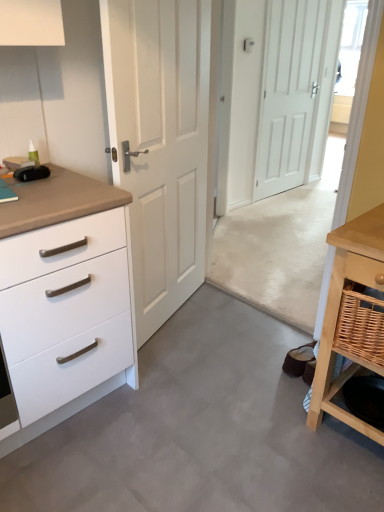
Describe the element at coordinates (200, 431) in the screenshot. The height and width of the screenshot is (512, 384). I see `gray laminate floor at center` at that location.

What is the approximate width of white matte chest of drawers at left?

The width of white matte chest of drawers at left is 25.38 inches.

The image size is (384, 512). Find the location of `transparent glass door at upper right`. transparent glass door at upper right is located at coordinates (348, 63).

What is the approximate width of transparent glass door at upper right?

9.49 centimeters.

What do you see at coordinates (160, 143) in the screenshot? The height and width of the screenshot is (512, 384). I see `white matte door at center, the 2th door when ordered from back to front` at bounding box center [160, 143].

Measure the distance between white matte door at center, arranged as the first door when viewed from the left, and camera.

white matte door at center, arranged as the first door when viewed from the left, and camera are 1.53 meters apart.

Measure the distance between point (363, 297) and camera.

Point (363, 297) is 4.42 feet from camera.

Where is `light wood table at lower right`? light wood table at lower right is located at coordinates (351, 317).

Which of these two, light wood table at lower right or gray laminate floor at center, is thinner?

light wood table at lower right is thinner.

How many degrees apart are the facing directions of light wood table at lower right and gray laminate floor at center?

light wood table at lower right and gray laminate floor at center are facing 180 degrees away from each other.

From a real-world perspective, is light wood table at lower right positioned over gray laminate floor at center based on gravity?

Indeed, from a real-world perspective, light wood table at lower right stands above gray laminate floor at center.

Relative to gray laminate floor at center, is light wood table at lower right in front or behind?

light wood table at lower right is behind gray laminate floor at center.

Where is `basket lying above the gray laminate floor at center (from the image's perspective)`? basket lying above the gray laminate floor at center (from the image's perspective) is located at coordinates (360, 328).

From a real-world perspective, which is physically above, gray laminate floor at center or woven brown basket at lower right?

woven brown basket at lower right is physically above.

Could you tell me if gray laminate floor at center is turned towards woven brown basket at lower right?

No, gray laminate floor at center is not turned towards woven brown basket at lower right.

Does point (245, 377) lie in front of point (372, 315)?

No, it is not.

From a real-world perspective, which door is the 1st one above the white matte chest of drawers at left? Please provide its 2D coordinates.

[(160, 143)]

Is point (102, 295) behind point (189, 62)?

That is False.

Is white matte chest of drawers at left directly adjacent to white matte door at center, placed as the 2th door when sorted from right to left?

No, white matte chest of drawers at left is not making contact with white matte door at center, placed as the 2th door when sorted from right to left.

From a real-world perspective, is white matte chest of drawers at left below white matte door at center, arranged as the first door when viewed from the left?

Correct, in the physical world, white matte chest of drawers at left is lower than white matte door at center, arranged as the first door when viewed from the left.

Is light wood table at lower right positioned with its back to white matte door at center, the 2th door when ordered from back to front?

light wood table at lower right is not turned away from white matte door at center, the 2th door when ordered from back to front.

Can you tell me how much light wood table at lower right and white matte door at center, which is counted as the first door, starting from the front, differ in facing direction?

109 degrees.

Which object is wider, light wood table at lower right or white matte door at center, placed as the 2th door when sorted from right to left?

With larger width is light wood table at lower right.

From the image's perspective, starting from the light wood table at lower right, which door is the 1st one above? Please provide its 2D coordinates.

[(160, 143)]

Which object is further away from the camera taking this photo, white matte chest of drawers at left or light wood table at lower right?

light wood table at lower right.

Measure the distance between white matte chest of drawers at left and light wood table at lower right.

white matte chest of drawers at left is 88.57 centimeters away from light wood table at lower right.

Is white matte chest of drawers at left bigger or smaller than light wood table at lower right?

Considering their sizes, white matte chest of drawers at left takes up more space than light wood table at lower right.

Considering the positions of objects white matte chest of drawers at left and light wood table at lower right in the image provided, who is more to the left, white matte chest of drawers at left or light wood table at lower right?

From the viewer's perspective, white matte chest of drawers at left appears more on the left side.

Who is shorter, white matte door at center, the first door in the back-to-front sequence, or gray laminate floor at center?

gray laminate floor at center is shorter.

Between white matte door at center, the first door in the back-to-front sequence, and gray laminate floor at center, which one has smaller width?

white matte door at center, the first door in the back-to-front sequence, is thinner.

At what (x,y) coordinates should I click in order to perform the action: click on concrete on the left of white matte door at center, the first door viewed from the right. Please return your answer as a coordinate pair (x, y). Looking at the image, I should click on point(200,431).

Is white matte door at center, positioned as the second door in front-to-back order, positioned with its back to gray laminate floor at center?

No, gray laminate floor at center is not at the back of white matte door at center, positioned as the second door in front-to-back order.

In the scene shown: Does white matte door at center, which is counted as the first door, starting from the front, have a larger size compared to light wood table at lower right?

Yes.

Is white matte door at center, the 2th door when ordered from back to front, not close to light wood table at lower right?

Yes, white matte door at center, the 2th door when ordered from back to front, and light wood table at lower right are quite far apart.

Is point (132, 186) positioned after point (346, 231)?

Yes, point (132, 186) is behind point (346, 231).

Would you say white matte door at center, which is counted as the first door, starting from the front, is outside light wood table at lower right?

white matte door at center, which is counted as the first door, starting from the front, lies outside light wood table at lower right's area.

Locate an element on the screen. The width and height of the screenshot is (384, 512). concrete that appears below the light wood table at lower right (from a real-world perspective) is located at coordinates (200, 431).

Locate an element on the screen. The image size is (384, 512). basket above the gray laminate floor at center (from the image's perspective) is located at coordinates (360, 328).

Estimate the real-world distances between objects in this image. Which object is closer to transparent glass door at upper right, woven brown basket at lower right or white matte door at center, the first door in the back-to-front sequence?

Based on the image, white matte door at center, the first door in the back-to-front sequence, appears to be nearer to transparent glass door at upper right.

When comparing their distances from white matte door at center, arranged as the first door when viewed from the left, does gray laminate floor at center or light wood table at lower right seem closer?

Based on the image, gray laminate floor at center appears to be nearer to white matte door at center, arranged as the first door when viewed from the left.

Which object lies further to the anchor point light wood table at lower right, white matte door at center, the 2th door when ordered from back to front, or woven brown basket at lower right?

The object further to light wood table at lower right is white matte door at center, the 2th door when ordered from back to front.

In the scene shown: Considering their positions, is light wood table at lower right positioned further to gray laminate floor at center than woven brown basket at lower right?

woven brown basket at lower right lies further to gray laminate floor at center than the other object.

Based on their spatial positions, is woven brown basket at lower right or gray laminate floor at center closer to transparent glass door at upper right?

gray laminate floor at center lies closer to transparent glass door at upper right than the other object.

In the scene shown: When comparing their distances from white matte door at center, placed as the 2th door when sorted from right to left, does woven brown basket at lower right or white matte door at center, positioned as the second door in front-to-back order, seem further?

Among the two, white matte door at center, positioned as the second door in front-to-back order, is located further to white matte door at center, placed as the 2th door when sorted from right to left.

From the image, which object appears to be nearer to white matte chest of drawers at left, transparent glass door at upper right or gray laminate floor at center?

Based on the image, gray laminate floor at center appears to be nearer to white matte chest of drawers at left.

Considering their positions, is white matte door at center, the first door in the back-to-front sequence, positioned closer to white matte door at center, arranged as the first door when viewed from the left, than light wood table at lower right?

The object closer to white matte door at center, arranged as the first door when viewed from the left, is light wood table at lower right.

You are a GUI agent. You are given a task and a screenshot of the screen. Output one action in this format:
    pyautogui.click(x=<x>, y=<y>)
    Task: Click on the door between woven brown basket at lower right and white matte door at center, the first door in the back-to-front sequence, along the z-axis
    Image resolution: width=384 pixels, height=512 pixels.
    Given the screenshot: What is the action you would take?
    pyautogui.click(x=160, y=143)

I want to click on table between white matte chest of drawers at left and transparent glass door at upper right in the front-back direction, so click(x=351, y=317).

Identify the location of basket situated between white matte chest of drawers at left and light wood table at lower right from left to right. The width and height of the screenshot is (384, 512). (360, 328).

This screenshot has height=512, width=384. Find the location of `basket located between white matte door at center, arranged as the first door when viewed from the left, and light wood table at lower right in the left-right direction`. basket located between white matte door at center, arranged as the first door when viewed from the left, and light wood table at lower right in the left-right direction is located at coordinates (360, 328).